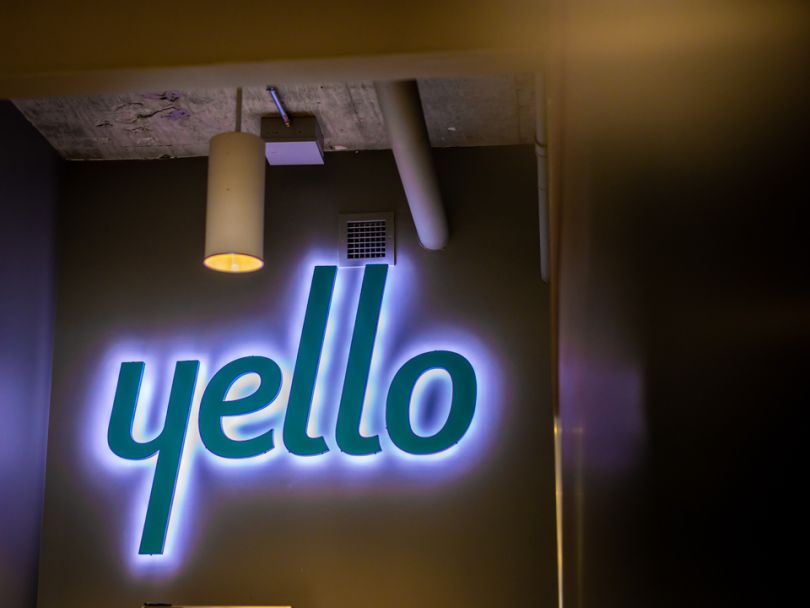
Find the location of `light yellow painted wall`. light yellow painted wall is located at coordinates coord(313,567).